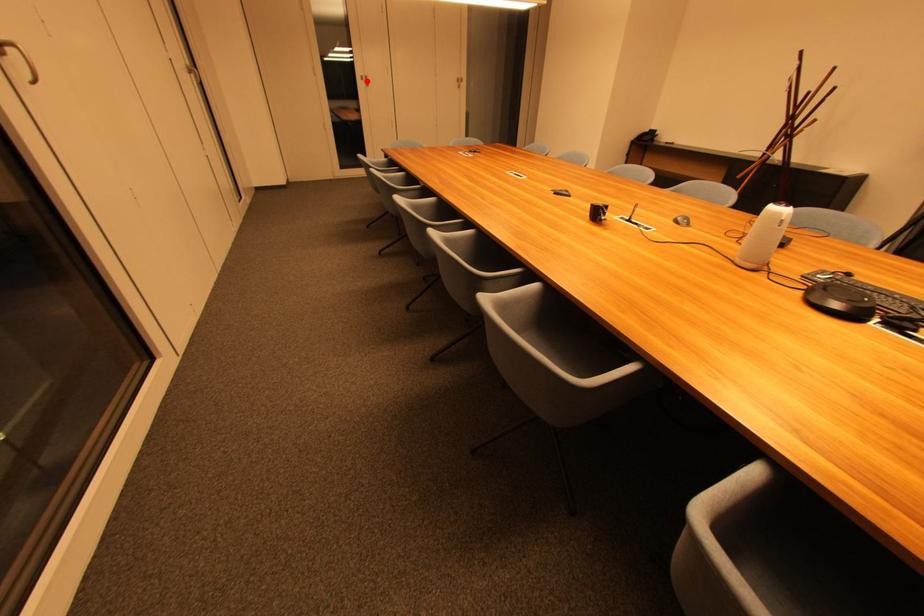
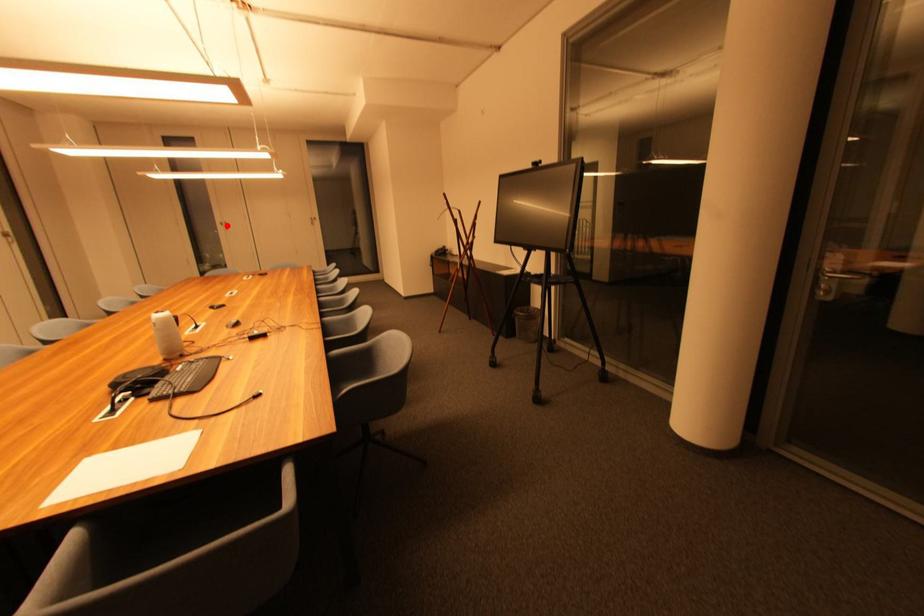
I am providing you with two images of the same scene from different viewpoints. A red point is marked on the first image and another point is marked on the second image. Is the marked point in image1 the same physical position as the marked point in image2?

Yes